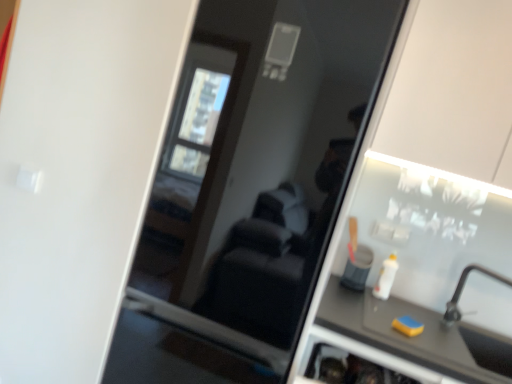
Question: Considering the relative sizes of white plastic bottle at right and silver metallic faucet at lower right in the image provided, is white plastic bottle at right taller than silver metallic faucet at lower right?

Choices:
 (A) no
 (B) yes

Answer: (A)

Question: Considering the relative sizes of white plastic bottle at right and silver metallic faucet at lower right in the image provided, is white plastic bottle at right shorter than silver metallic faucet at lower right?

Choices:
 (A) yes
 (B) no

Answer: (A)

Question: Is white plastic bottle at right outside of silver metallic faucet at lower right?

Choices:
 (A) no
 (B) yes

Answer: (B)

Question: Considering the relative sizes of white plastic bottle at right and silver metallic faucet at lower right in the image provided, is white plastic bottle at right bigger than silver metallic faucet at lower right?

Choices:
 (A) yes
 (B) no

Answer: (B)

Question: Is white plastic bottle at right positioned with its back to silver metallic faucet at lower right?

Choices:
 (A) yes
 (B) no

Answer: (B)

Question: Looking at their shapes, would you say yellow sponge at lower right is wider or thinner than transparent glass screen door at center?

Choices:
 (A) thin
 (B) wide

Answer: (A)

Question: From the image's perspective, relative to transparent glass screen door at center, is yellow sponge at lower right above or below?

Choices:
 (A) above
 (B) below

Answer: (B)

Question: Relative to transparent glass screen door at center, is yellow sponge at lower right in front or behind?

Choices:
 (A) front
 (B) behind

Answer: (B)

Question: Would you say yellow sponge at lower right is to the left or to the right of transparent glass screen door at center in the picture?

Choices:
 (A) left
 (B) right

Answer: (B)

Question: From a real-world perspective, is white plastic bottle at right physically located above or below transparent glass screen door at center?

Choices:
 (A) below
 (B) above

Answer: (A)

Question: Considering the positions of white plastic bottle at right and transparent glass screen door at center in the image, is white plastic bottle at right taller or shorter than transparent glass screen door at center?

Choices:
 (A) tall
 (B) short

Answer: (B)

Question: Considering the positions of point (379, 297) and point (301, 249), is point (379, 297) closer or farther from the camera than point (301, 249)?

Choices:
 (A) farther
 (B) closer

Answer: (A)

Question: From the image's perspective, is white plastic bottle at right above or below transparent glass screen door at center?

Choices:
 (A) below
 (B) above

Answer: (A)

Question: In terms of height, does transparent glass screen door at center look taller or shorter compared to white plastic bottle at right?

Choices:
 (A) short
 (B) tall

Answer: (B)

Question: In the image, is transparent glass screen door at center on the left side or the right side of white plastic bottle at right?

Choices:
 (A) right
 (B) left

Answer: (B)